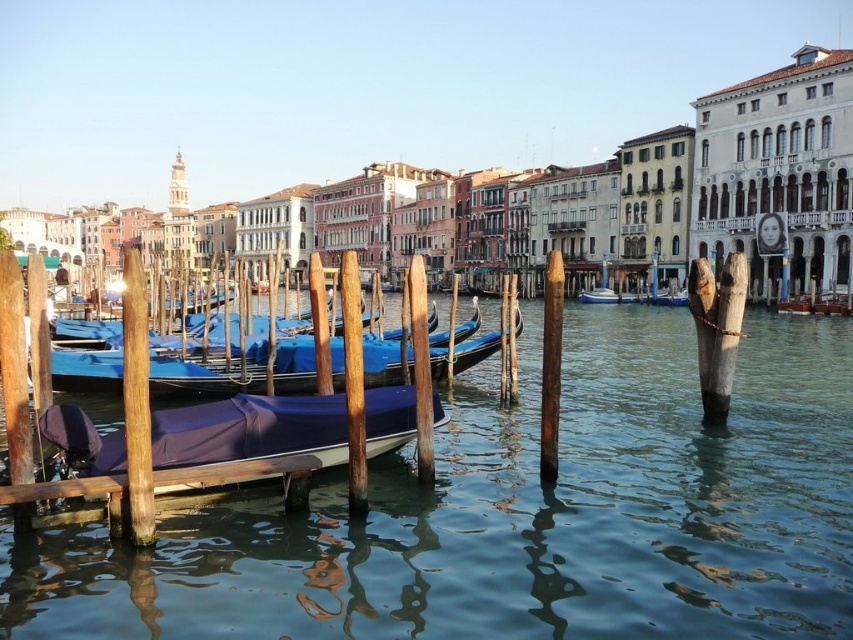
Is the position of blue fabric boat at center more distant than that of brown wooden dock at lower left?

That is True.

Is blue fabric boat at center thinner than brown wooden dock at lower left?

In fact, blue fabric boat at center might be wider than brown wooden dock at lower left.

This screenshot has width=853, height=640. I want to click on blue fabric boat at center, so click(x=202, y=378).

Identify the location of blue fabric boat at center. This screenshot has width=853, height=640. (202, 378).

Who is more distant from viewer, (677, 611) or (151, 394)?

Point (151, 394)

In the scene shown: Can you confirm if blue fabric-covered boat at center is positioned to the right of blue fabric boat at center?

Correct, you'll find blue fabric-covered boat at center to the right of blue fabric boat at center.

Between point (625, 403) and point (115, 372), which one is positioned in front?

Point (115, 372)

Locate an element on the screen. blue fabric-covered boat at center is located at coordinates (520, 513).

Measure the distance between blue fabric-covered boat at center and camera.

They are 39.80 meters apart.

Does blue fabric-covered boat at center have a greater width compared to blue glossy boat at center?

Indeed, blue fabric-covered boat at center has a greater width compared to blue glossy boat at center.

Where is `blue fabric-covered boat at center`? blue fabric-covered boat at center is located at coordinates (520, 513).

Where is `blue fabric-covered boat at center`? The image size is (853, 640). blue fabric-covered boat at center is located at coordinates [520, 513].